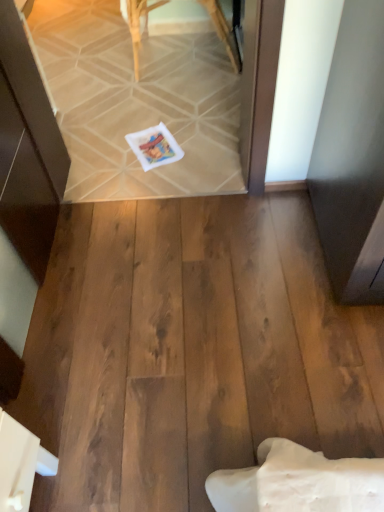
You are a GUI agent. You are given a task and a screenshot of the screen. Output one action in this format:
    pyautogui.click(x=<x>, y=<y>)
    Task: Click on the free space above white matte postcard at center (from a real-world perspective)
    Image resolution: width=384 pixels, height=512 pixels.
    Given the screenshot: What is the action you would take?
    pyautogui.click(x=161, y=141)